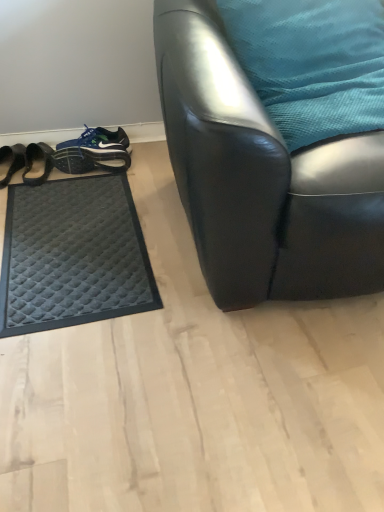
I want to click on blank space situated above black quilted mat at lower left (from a real-world perspective), so click(77, 232).